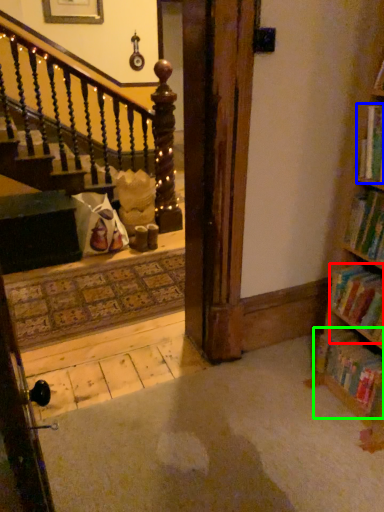
Question: Based on their relative distances, which object is farther from book (highlighted by a red box)? Choose from book (highlighted by a blue box) and book (highlighted by a green box).

Choices:
 (A) book
 (B) book

Answer: (A)